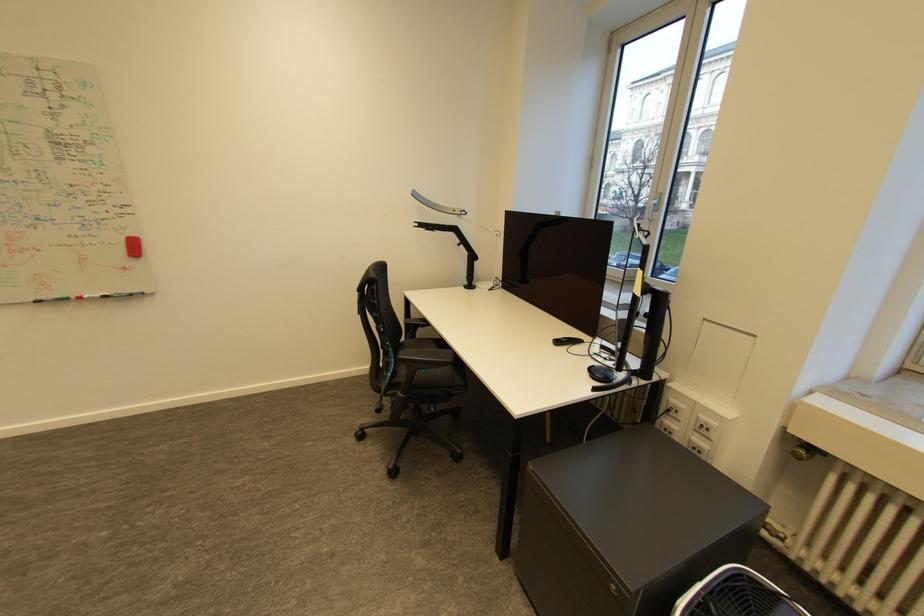
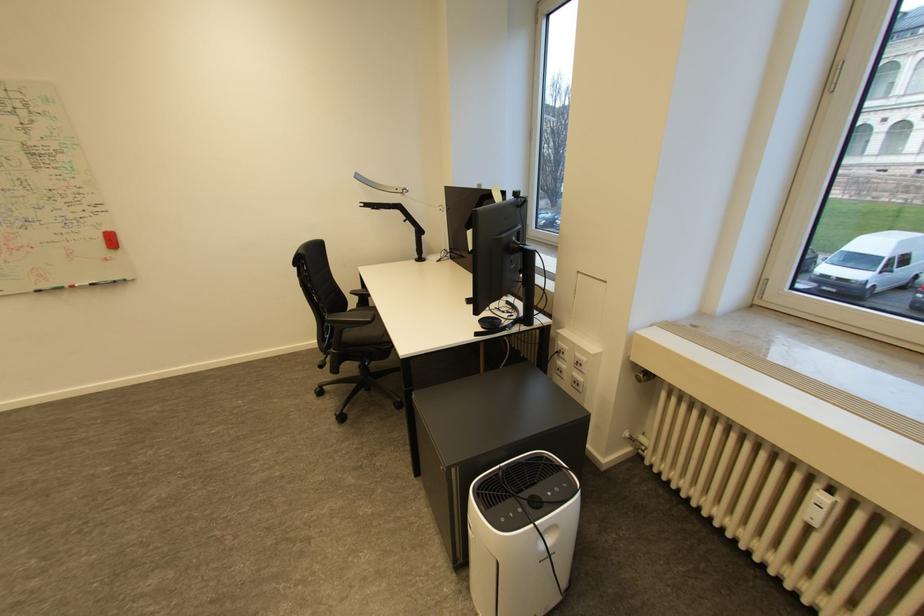
The point at (407, 342) is marked in the first image. Where is the corresponding point in the second image?

(355, 310)